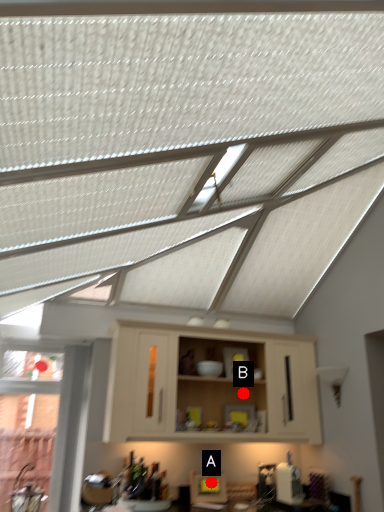
Question: Two points are circled on the image, labeled by A and B beside each circle. Which point is closer to the camera?

Choices:
 (A) A is closer
 (B) B is closer

Answer: (A)